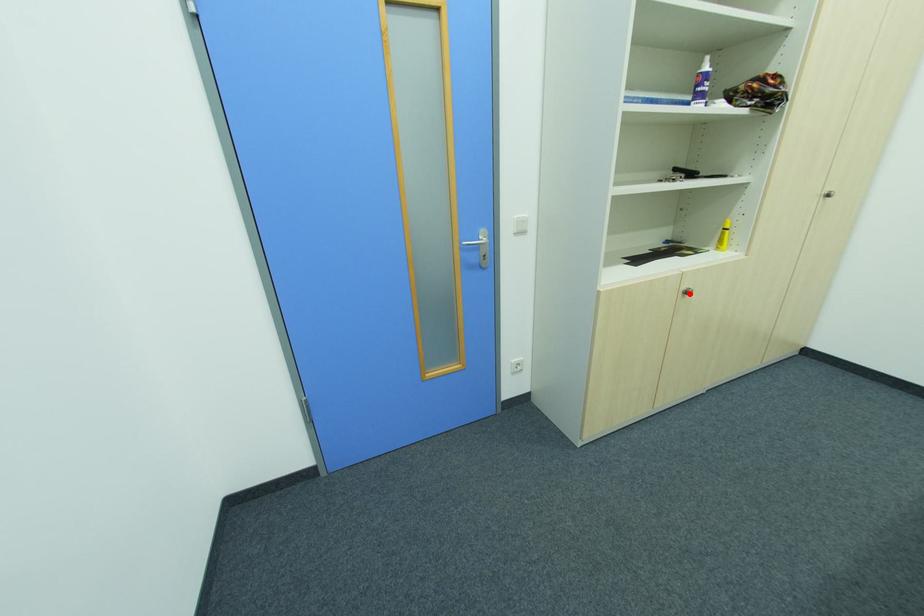
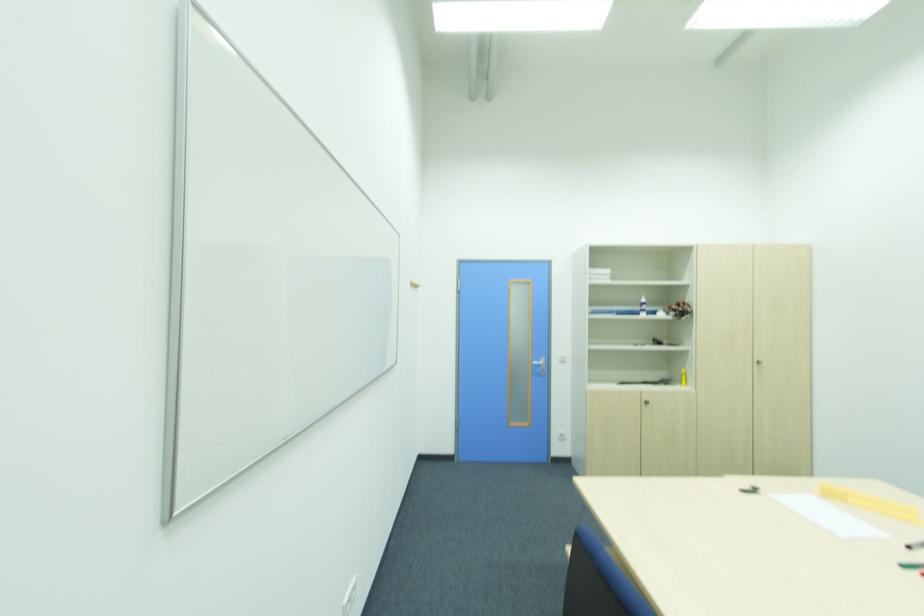
Question: I am providing you with two images of the same scene from different viewpoints. Image1 has a red point marked. In image2, the corresponding 3D location appears at what relative position? Reply with the corresponding letter.

Choices:
 (A) Closer
 (B) Farther

Answer: (B)